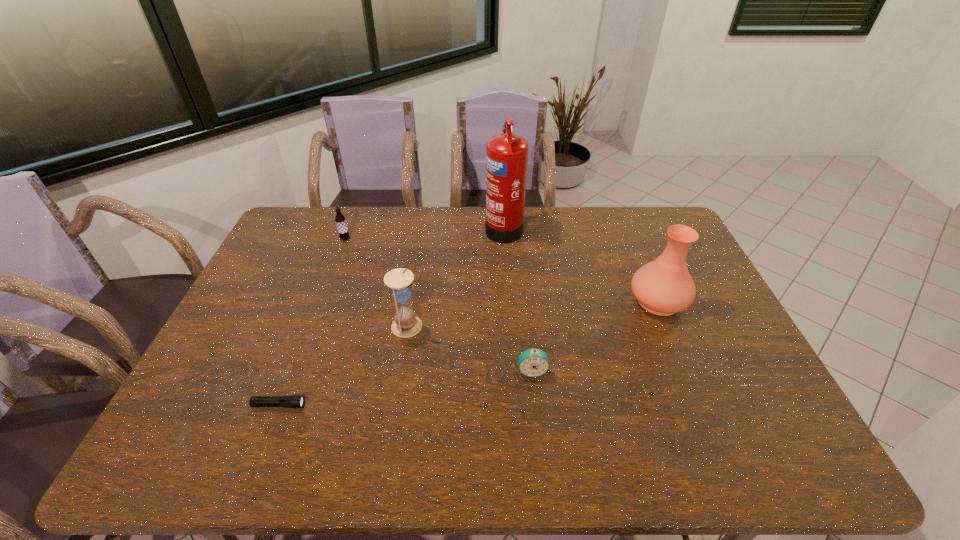
Where is `free space between the shortest object and the tallest object`? The image size is (960, 540). free space between the shortest object and the tallest object is located at coordinates (392, 316).

Find the location of a particular element. The height and width of the screenshot is (540, 960). free spot between the second tallest object and the tallest object is located at coordinates (581, 264).

The image size is (960, 540). Find the location of `vacant area that lies between the alarm clock and the flashlight`. vacant area that lies between the alarm clock and the flashlight is located at coordinates (406, 388).

In order to click on free point between the third shortest object and the hourglass in this screenshot , I will do tap(377, 282).

Find the location of a particular element. The image size is (960, 540). free area in between the fifth tallest object and the fire extinguisher is located at coordinates (517, 299).

Identify which object is the second closest to the vase. Please provide its 2D coordinates. Your answer should be formatted as a tuple, i.e. [(x, y)], where the tuple contains the x and y coordinates of a point satisfying the conditions above.

[(506, 154)]

Select which object appears as the closest to the vase. Please provide its 2D coordinates. Your answer should be formatted as a tuple, i.e. [(x, y)], where the tuple contains the x and y coordinates of a point satisfying the conditions above.

[(533, 362)]

You are a GUI agent. You are given a task and a screenshot of the screen. Output one action in this format:
    pyautogui.click(x=<x>, y=<y>)
    Task: Click on the free location that satisfies the following two spatial constraints: 1. on the front-facing side of the fifth tallest object; 2. at the lens end of the flashlight
    The image size is (960, 540).
    Given the screenshot: What is the action you would take?
    pyautogui.click(x=536, y=405)

This screenshot has height=540, width=960. What are the coordinates of `vacant space that satisfies the following two spatial constraints: 1. on the front side of the fourth object from right to left; 2. at the lens end of the flashlight` in the screenshot? It's located at (396, 405).